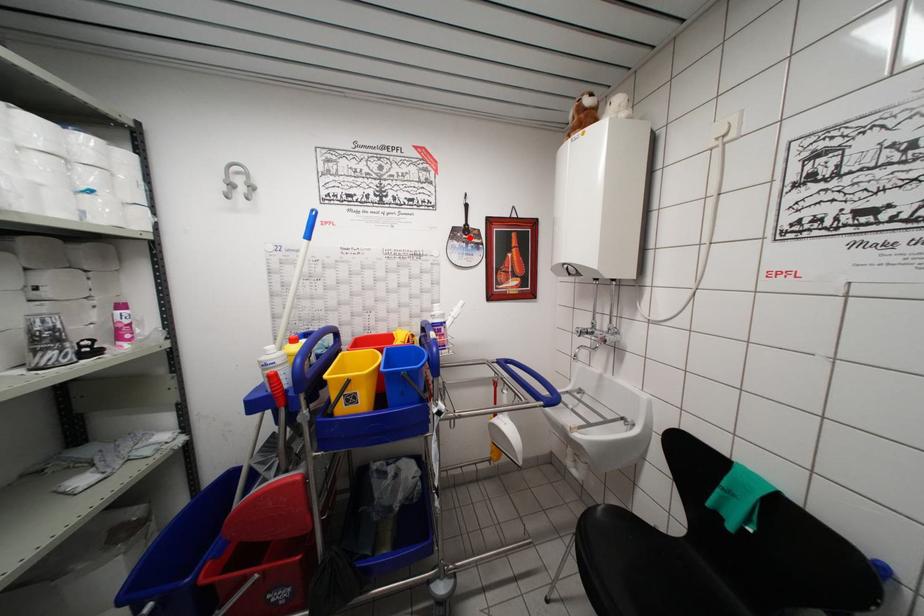
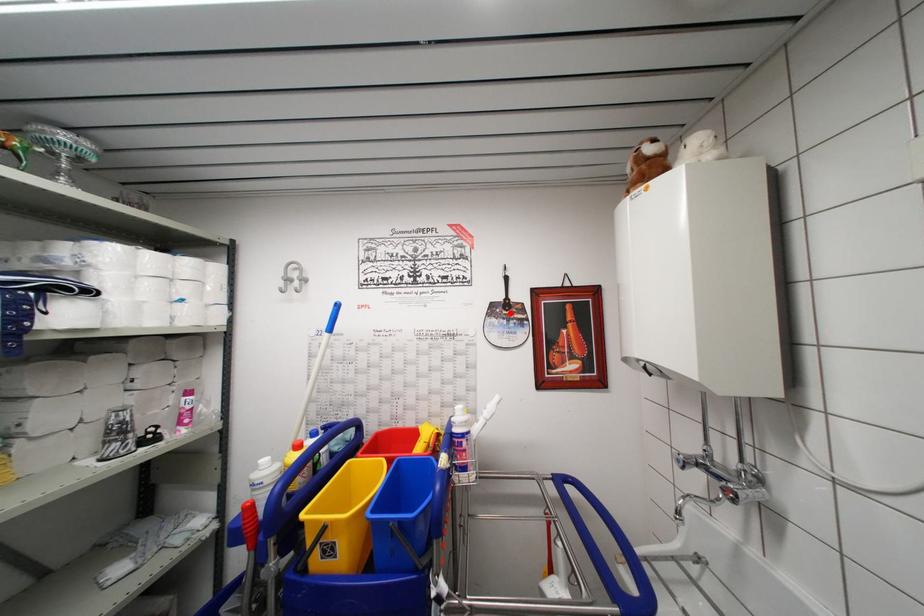
I am providing you with two images of the same scene from different viewpoints. A red point is marked on the first image and another point is marked on the second image. Are the points marked in image1 and image2 representing the same 3D position?

Yes